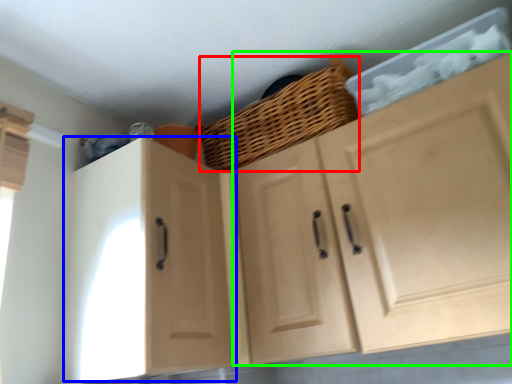
Question: Which is nearer to the basket (highlighted by a red box)? cabinetry (highlighted by a blue box) or cabinetry (highlighted by a green box).

Choices:
 (A) cabinetry
 (B) cabinetry

Answer: (B)